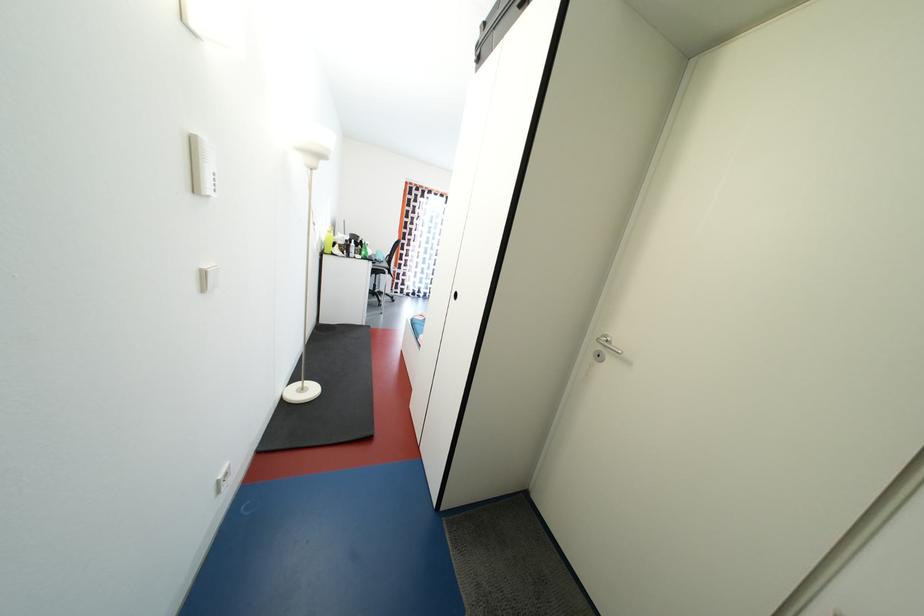
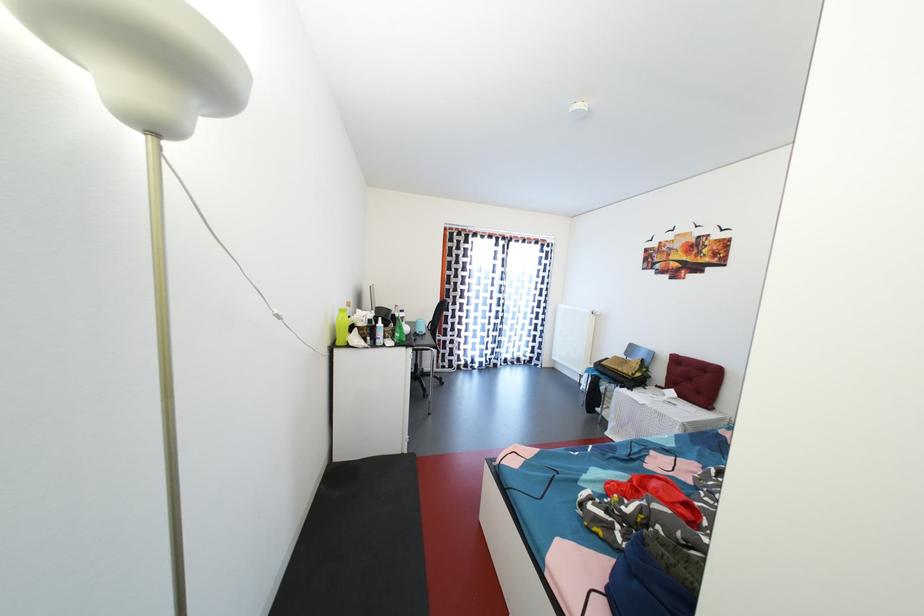
The point at (353, 246) is marked in the first image. Where is the corresponding point in the second image?

(377, 326)